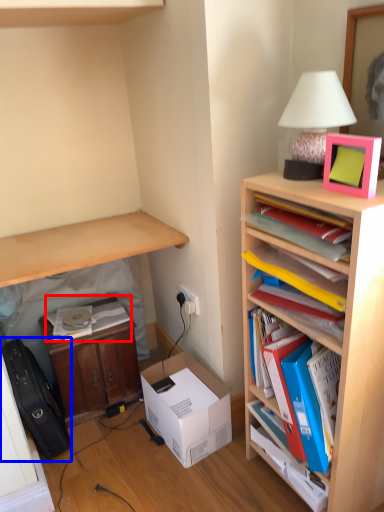
Question: Which object is further to the camera taking this photo, book (highlighted by a red box) or luggage (highlighted by a blue box)?

Choices:
 (A) book
 (B) luggage

Answer: (A)